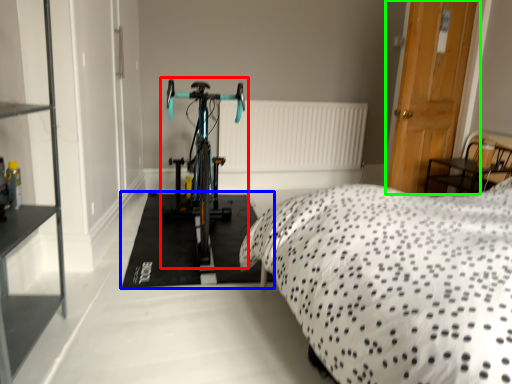
Question: Based on their relative distances, which object is nearer to bicycle (highlighted by a red box)? Choose from flat (highlighted by a blue box) and door (highlighted by a green box).

Choices:
 (A) flat
 (B) door

Answer: (A)